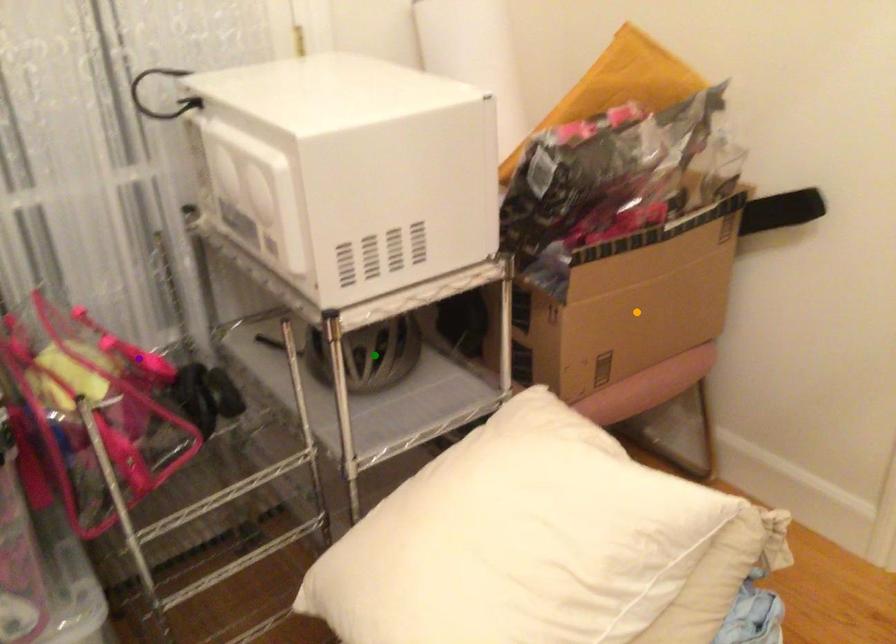
Order these from nearest to farthest:
1. orange point
2. purple point
3. green point

1. orange point
2. green point
3. purple point